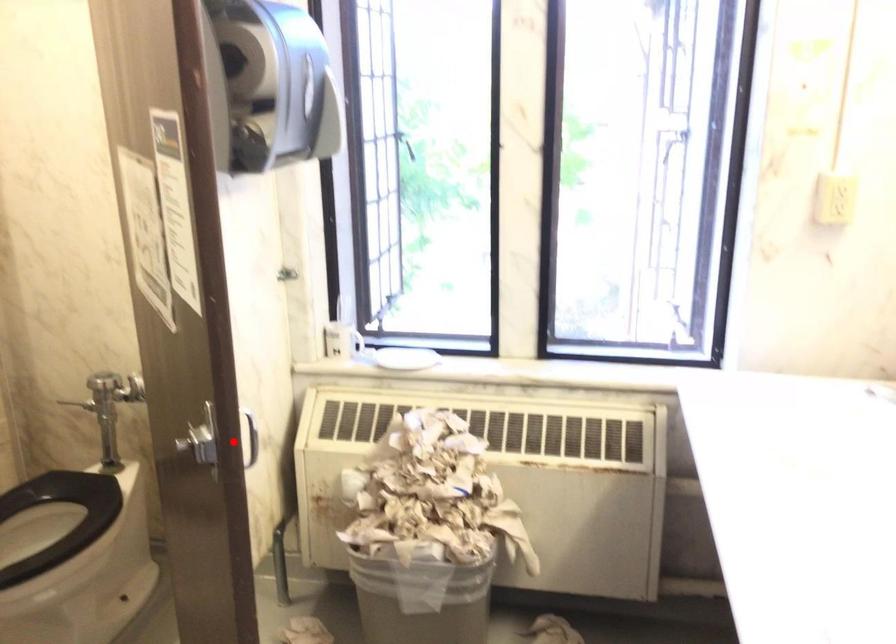
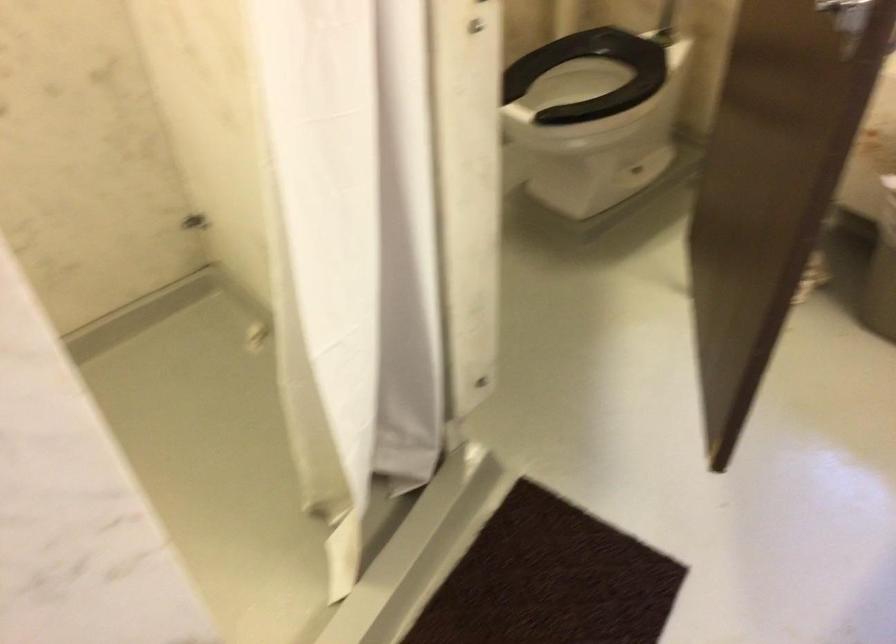
Question: I am providing you with two images of the same scene from different viewpoints. In image1, a red point is highlighted. Considering the same 3D point in image2, which of the following is correct?

Choices:
 (A) It is closer
 (B) It is farther

Answer: (A)